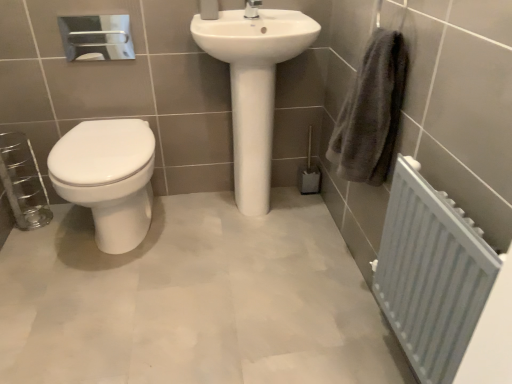
The height and width of the screenshot is (384, 512). I want to click on vacant space underneath gray cotton towel at right (from a real-world perspective), so click(333, 268).